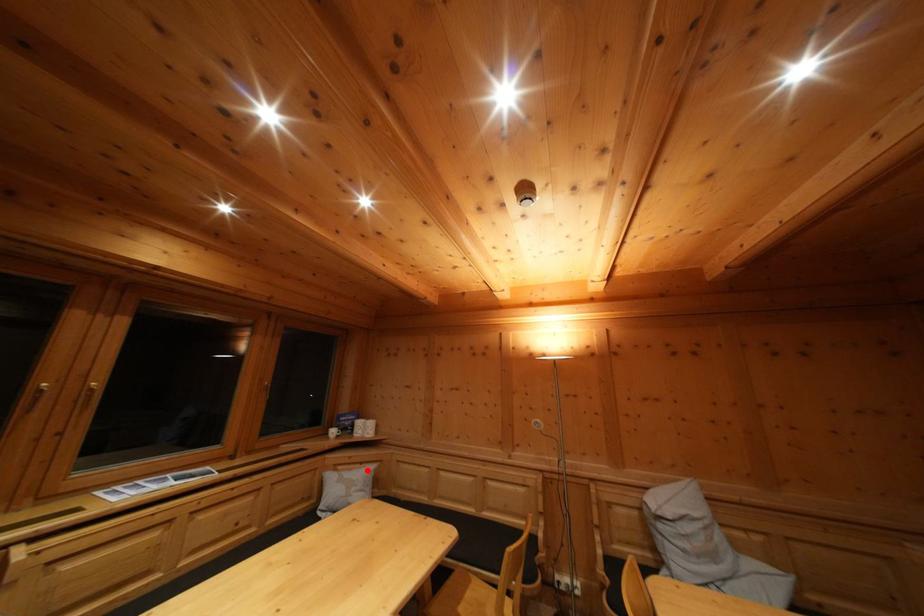
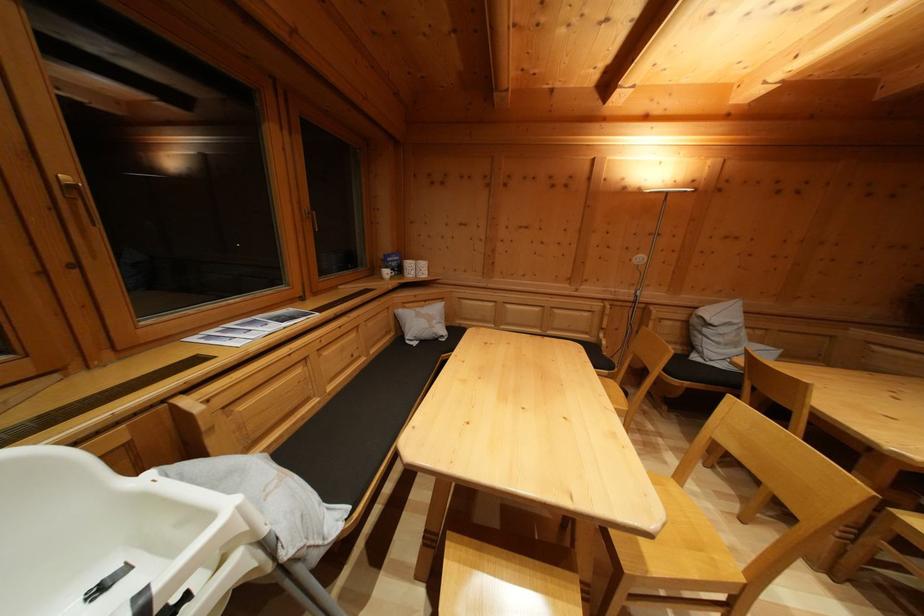
Locate, in the second image, the point that corresponds to the highlighted location in the first image.

(431, 308)